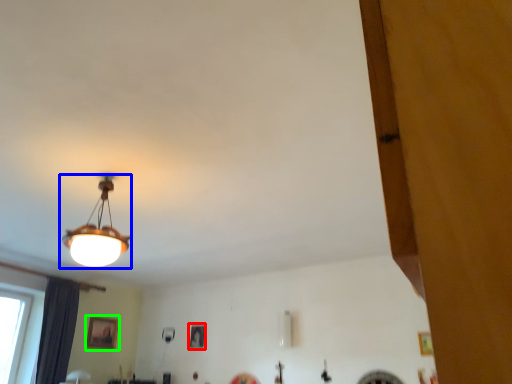
Question: Considering the real-world distances, which object is farthest from picture frame (highlighted by a red box)? lamp (highlighted by a blue box) or picture frame (highlighted by a green box)?

Choices:
 (A) lamp
 (B) picture frame

Answer: (A)